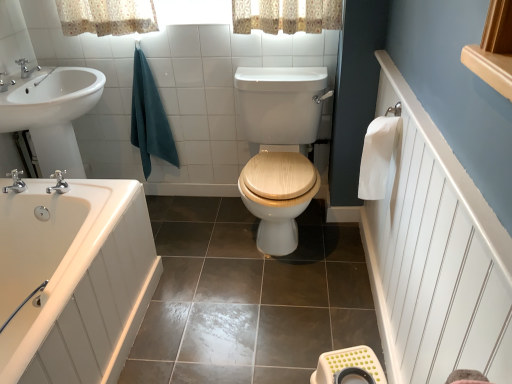
Question: Is teal cotton towel at upper left, marked as the first bath towel in a back-to-front arrangement, taller or shorter than white paper towel at right, which ranks as the second bath towel in left-to-right order?

Choices:
 (A) tall
 (B) short

Answer: (A)

Question: From the image's perspective, is teal cotton towel at upper left, marked as the first bath towel in a back-to-front arrangement, located above or below white paper towel at right, which ranks as the second bath towel in left-to-right order?

Choices:
 (A) below
 (B) above

Answer: (B)

Question: Estimate the real-world distances between objects in this image. Which object is farther from the white plastic stool at lower right?

Choices:
 (A) silver metallic faucet at upper left, the second tap from the back
 (B) teal cotton towel at upper left, arranged as the 2th bath towel when viewed from the right
 (C) white paper towel at right, the second bath towel from the back
 (D) brushed metal faucet at upper left, which ranks as the 1th tap in top-to-bottom order
 (E) white glossy bathtub at lower left

Answer: (D)

Question: Considering the real-world distances, which object is farthest from the white paper towel at right, which ranks as the 1th bath towel in front-to-back order?

Choices:
 (A) wooden at center
 (B) brushed metal faucet at upper left, which is the third tap in front-to-back order
 (C) silver metallic faucet at left, which is the 3th tap from back to front
 (D) teal cotton towel at upper left, arranged as the 2th bath towel when viewed from the right
 (E) silver metallic faucet at upper left, the second tap from the back

Answer: (B)